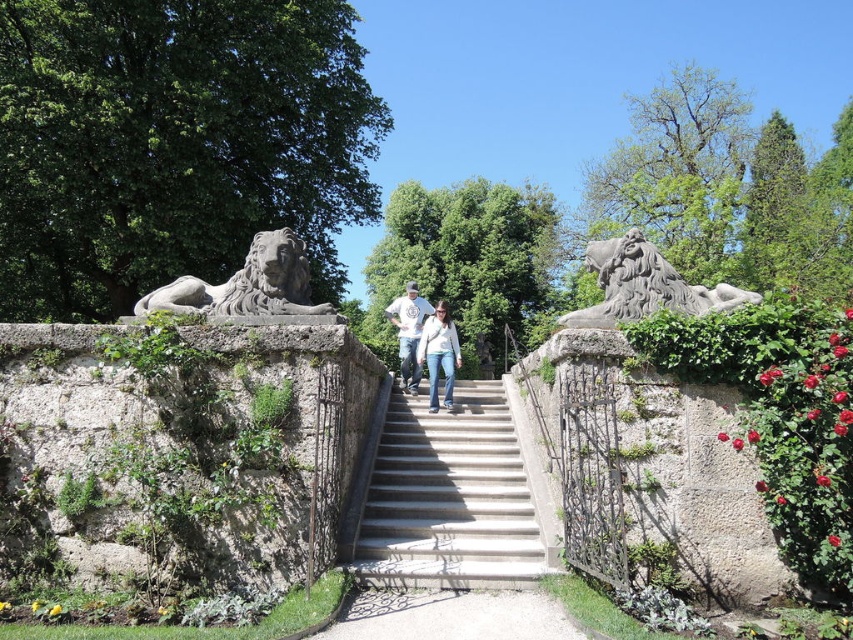
You are standing at the bottom of the concrete stairs at center and want to place a small potted plant between the stairs and the gray stone lion at left. Considering the height difference between them, where should you place the plant so it is visible from above?

The concrete stairs at center are taller than the gray stone lion at left, so placing the potted plant on the lower part of the stairs near the gray stone lion at left would ensure it remains visible from above without being blocked by the stairs.

You are a painter standing at the bottom of the stone stairs. You want to paint both the gray stone lion at left and the white cotton shirt at center. Which object should you paint first if you want to start with the one closer to you?

The gray stone lion at left is closer to you than the white cotton shirt at center, so you should paint the gray stone lion at left first.